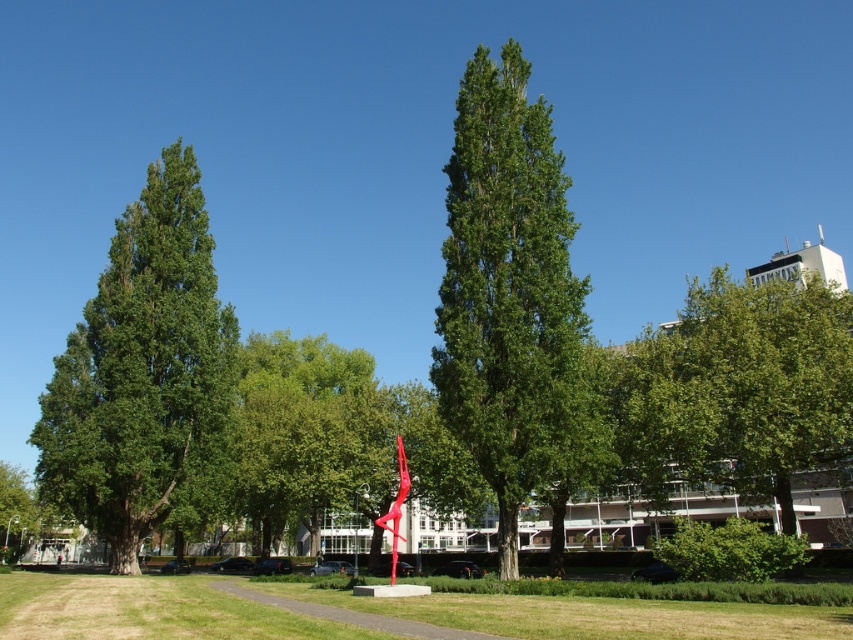
You are planning to install a new bench in the park. The bench requires a spot where it won which object is taller, the green leafy tree at right or the metallic red sculpture at center?

The metallic red sculpture at center is taller than the green leafy tree at right according to the description provided.

You are standing at the point marked by the coordinates point (740, 388). Looking around, you see a green leafy tree at right. Which direction should you walk to reach the green leafy tree at right?

The point (740, 388) is already on the green leafy tree at right, so you are already at the tree.

Consider the image. You are a gardener planning to plant a new flower bed between the green leafy tree at left and the green grass at center. Based on their positions, which object is closer to you where you would start digging?

The green leafy tree at left is closer to you than the green grass at center, so you should start digging near the green leafy tree at left.